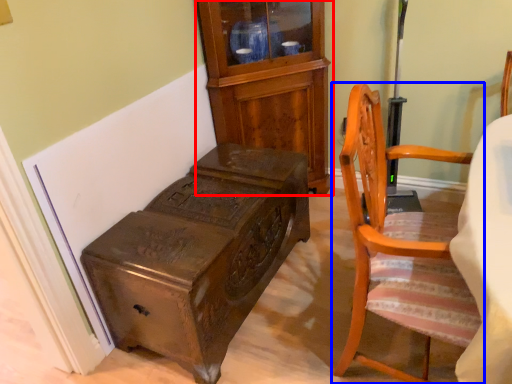
Question: Which object is closer to the camera taking this photo, cabinetry (highlighted by a red box) or chair (highlighted by a blue box)?

Choices:
 (A) cabinetry
 (B) chair

Answer: (B)